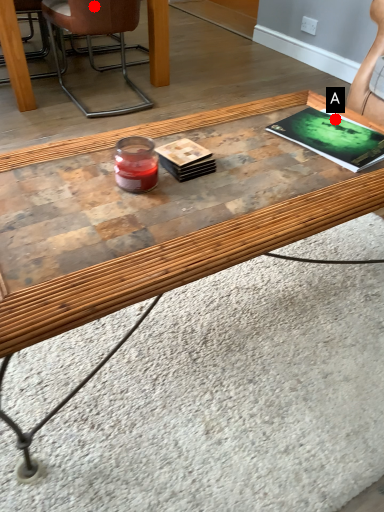
Question: Two points are circled on the image, labeled by A and B beside each circle. Which of the following is the farthest from the observer?

Choices:
 (A) A is further
 (B) B is further

Answer: (B)